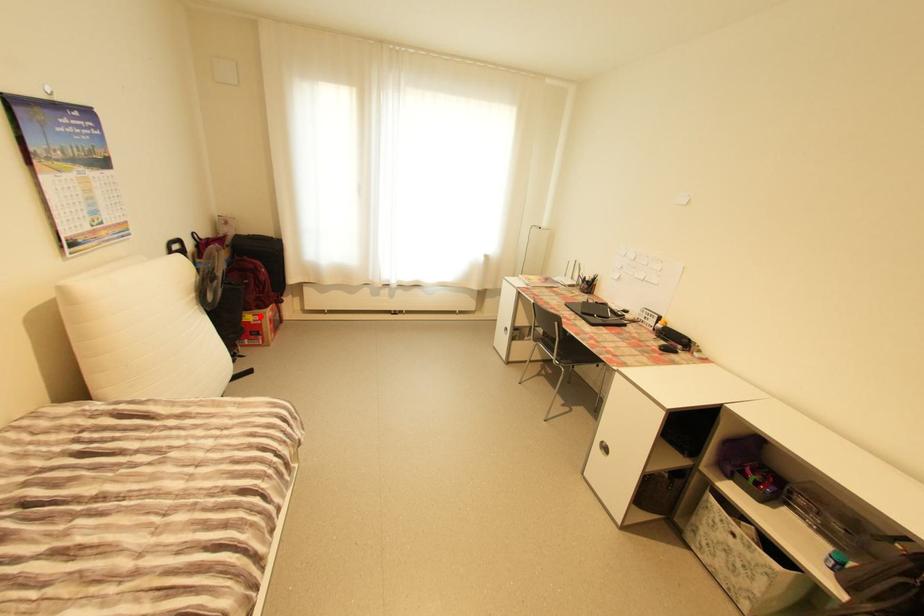
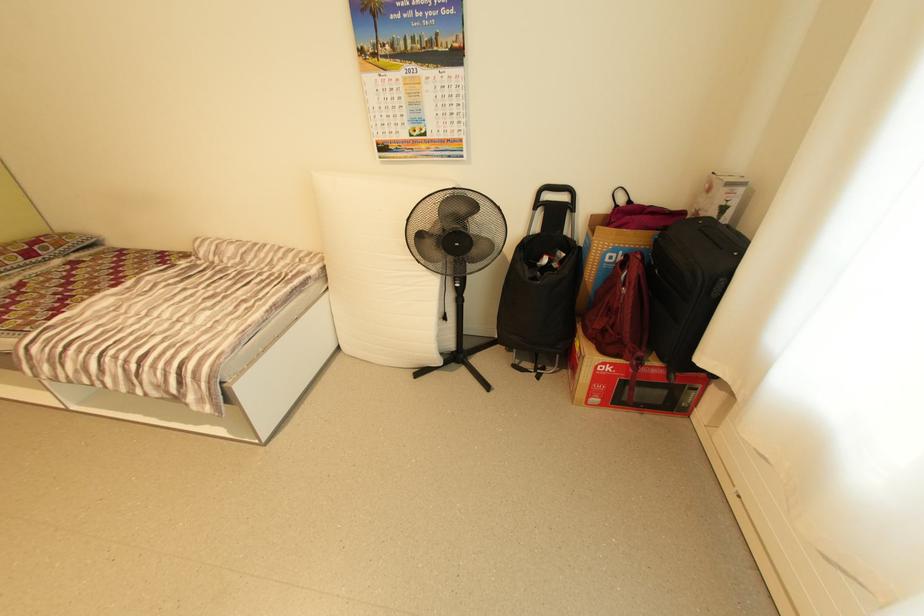
Where in the second image is the point corresponding to the highlighted location from the first image?

(586, 347)